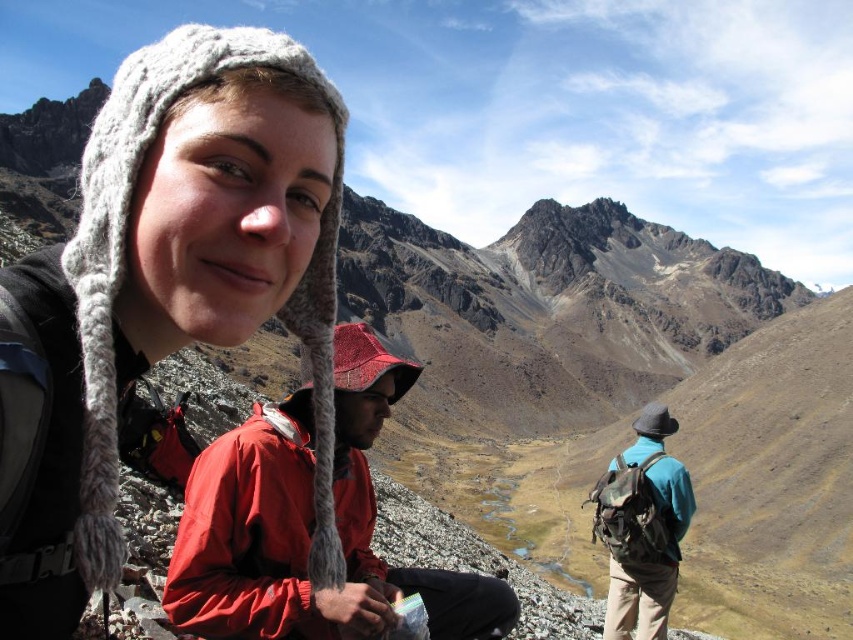
Consider the image. Can you confirm if red waterproof jacket at center is positioned to the right of teal fabric backpack at right?

Incorrect, red waterproof jacket at center is not on the right side of teal fabric backpack at right.

Is red waterproof jacket at center bigger than teal fabric backpack at right?

Correct, red waterproof jacket at center is larger in size than teal fabric backpack at right.

This screenshot has height=640, width=853. Find the location of `red waterproof jacket at center`. red waterproof jacket at center is located at coordinates (309, 524).

Does knitted wool hat at upper left have a greater width compared to teal fabric backpack at right?

Yes, knitted wool hat at upper left is wider than teal fabric backpack at right.

Who is more forward, (86,305) or (634,449)?

Point (86,305) is more forward.

You are a GUI agent. You are given a task and a screenshot of the screen. Output one action in this format:
    pyautogui.click(x=<x>, y=<y>)
    Task: Click on the knitted wool hat at upper left
    
    Given the screenshot: What is the action you would take?
    pyautogui.click(x=120, y=317)

Can you confirm if rugged stone mountain at upper center is thinner than teal fabric backpack at right?

In fact, rugged stone mountain at upper center might be wider than teal fabric backpack at right.

Between rugged stone mountain at upper center and teal fabric backpack at right, which one is positioned lower?

teal fabric backpack at right

Who is more distant from viewer, (595, 400) or (625, 563)?

The point (595, 400) is more distant.

This screenshot has height=640, width=853. In order to click on rugged stone mountain at upper center in this screenshot , I will do `click(548, 310)`.